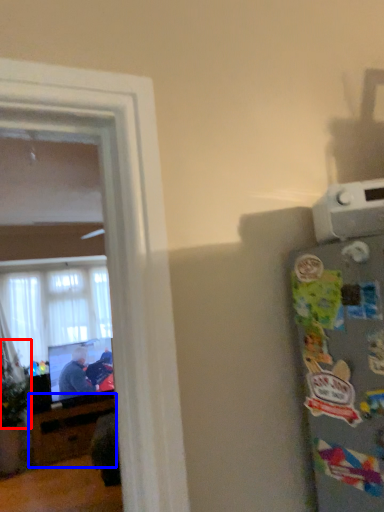
Question: Among these objects, which one is nearest to the camera, plant (highlighted by a red box) or entertainment center (highlighted by a blue box)?

Choices:
 (A) plant
 (B) entertainment center

Answer: (A)